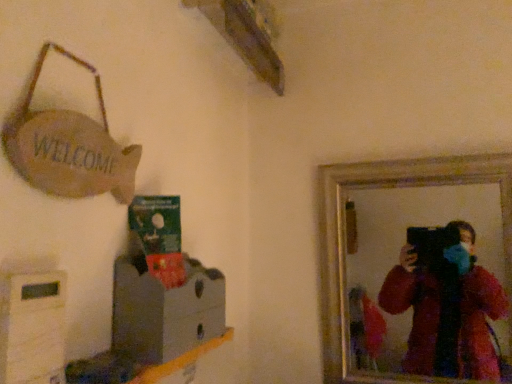
Locate an element on the screen. wooden mirror at upper right is located at coordinates (429, 282).

Image resolution: width=512 pixels, height=384 pixels. What do you see at coordinates (429, 282) in the screenshot?
I see `wooden mirror at upper right` at bounding box center [429, 282].

Where is `wooden mirror at upper right`? This screenshot has width=512, height=384. wooden mirror at upper right is located at coordinates (429, 282).